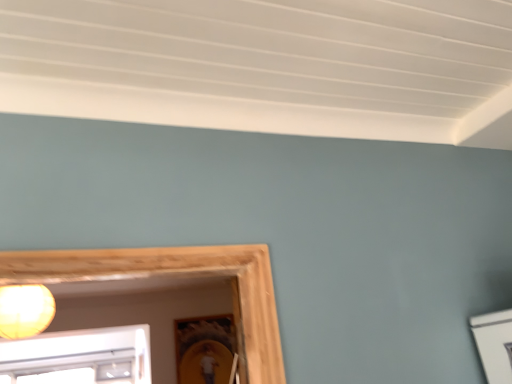
Question: From the image's perspective, is matte yellow bulb at upper left located above or below matte wooden picture frame at lower center?

Choices:
 (A) above
 (B) below

Answer: (A)

Question: Considering the positions of matte yellow bulb at upper left and matte wooden picture frame at lower center in the image, is matte yellow bulb at upper left taller or shorter than matte wooden picture frame at lower center?

Choices:
 (A) short
 (B) tall

Answer: (A)

Question: In the image, is matte yellow bulb at upper left on the left side or the right side of matte wooden picture frame at lower center?

Choices:
 (A) left
 (B) right

Answer: (A)

Question: Considering the positions of matte wooden picture frame at lower center and matte yellow bulb at upper left in the image, is matte wooden picture frame at lower center taller or shorter than matte yellow bulb at upper left?

Choices:
 (A) short
 (B) tall

Answer: (B)

Question: Looking at the image, does matte wooden picture frame at lower center seem bigger or smaller compared to matte yellow bulb at upper left?

Choices:
 (A) big
 (B) small

Answer: (B)

Question: Is point (210, 344) closer or farther from the camera than point (32, 288)?

Choices:
 (A) closer
 (B) farther

Answer: (B)

Question: Is matte wooden picture frame at lower center situated inside matte yellow bulb at upper left or outside?

Choices:
 (A) inside
 (B) outside

Answer: (B)